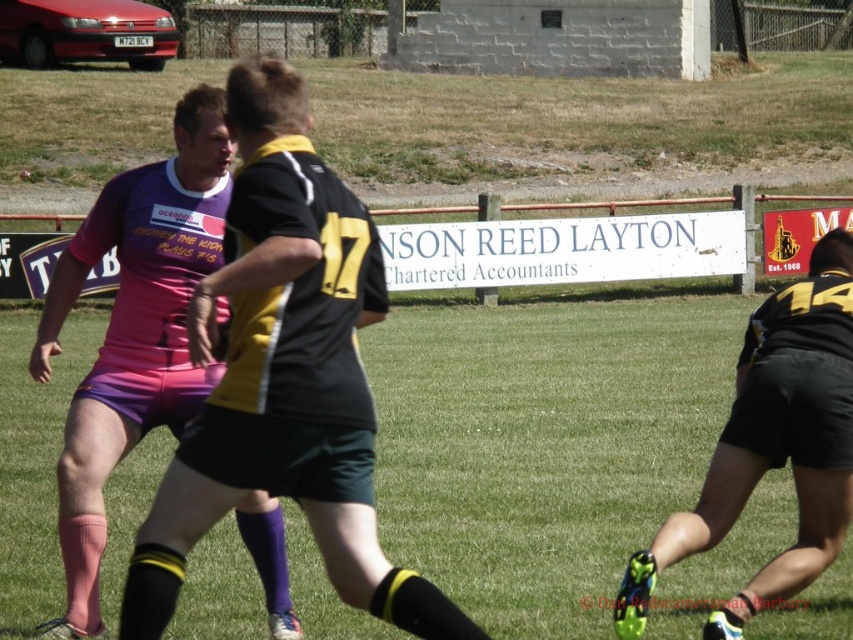
Question: Considering the relative positions of matte black jersey at center and pink fabric shorts at center in the image provided, where is matte black jersey at center located with respect to pink fabric shorts at center?

Choices:
 (A) below
 (B) above

Answer: (B)

Question: Does pink fabric shorts at center come in front of black matte shorts at right?

Choices:
 (A) yes
 (B) no

Answer: (B)

Question: Which of the following is the farthest from the observer?

Choices:
 (A) (119, 435)
 (B) (297, 349)

Answer: (A)

Question: Which of the following is the closest to the observer?

Choices:
 (A) (817, 390)
 (B) (38, 342)

Answer: (A)

Question: Which object is closer to the camera taking this photo?

Choices:
 (A) pink fabric shorts at center
 (B) black matte shorts at right

Answer: (B)

Question: Observing the image, what is the correct spatial positioning of pink fabric shorts at center in reference to black matte shorts at right?

Choices:
 (A) left
 (B) right

Answer: (A)